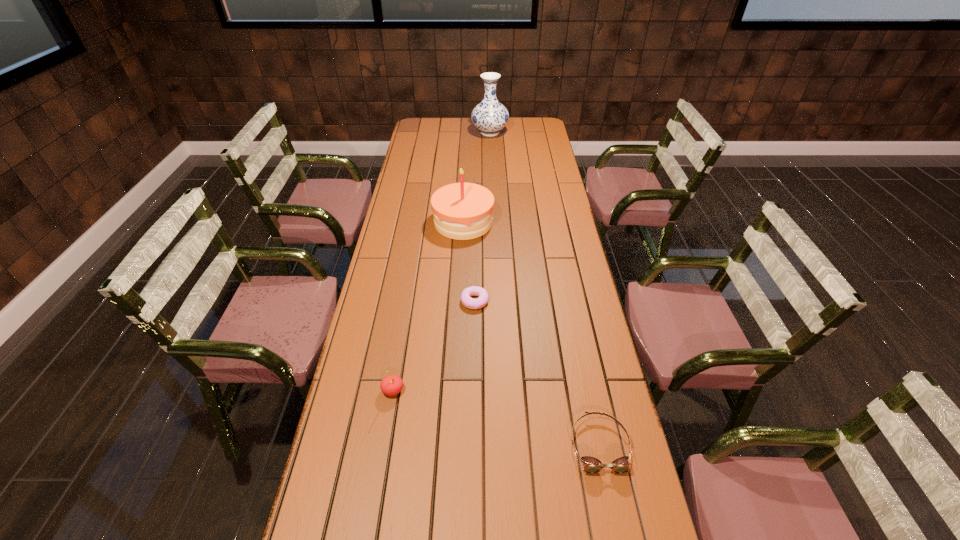
This screenshot has width=960, height=540. What are the coordinates of `free space located 0.070m on the right of the farthest object` in the screenshot? It's located at (521, 133).

I want to click on vacant space located 0.110m on the back of the second tallest object, so click(x=465, y=191).

You are a GUI agent. You are given a task and a screenshot of the screen. Output one action in this format:
    pyautogui.click(x=<x>, y=<y>)
    Task: Click on the vacant region located 0.060m on the front of the third tallest object
    
    Given the screenshot: What is the action you would take?
    pyautogui.click(x=388, y=420)

Image resolution: width=960 pixels, height=540 pixels. Find the location of `free space located through the lenses of the nearest object`. free space located through the lenses of the nearest object is located at coordinates (617, 536).

The height and width of the screenshot is (540, 960). Identify the location of free space located on the back of the third farthest object. (475, 247).

The width and height of the screenshot is (960, 540). What are the coordinates of `object present at the far edge` in the screenshot? It's located at (489, 116).

I want to click on object that is at the left edge, so click(x=391, y=385).

The width and height of the screenshot is (960, 540). Identify the location of object that is at the right edge. (591, 465).

In the image, there is a desktop. At what (x,y) coordinates should I click in order to perform the action: click on vacant area at the far edge. Please return your answer as a coordinate pair (x, y). The image size is (960, 540). Looking at the image, I should click on (456, 133).

This screenshot has height=540, width=960. In the image, there is a desktop. Identify the location of free space at the left edge. (348, 501).